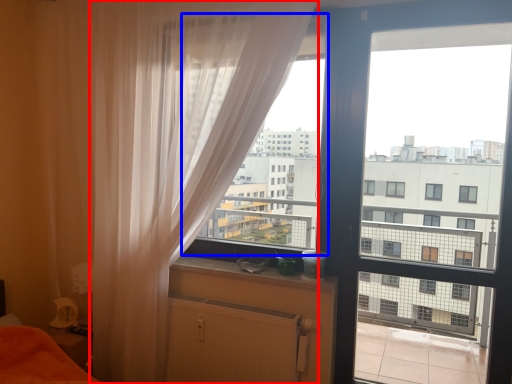
Question: Which point is closer to the camera, curtain (highlighted by a red box) or window screen (highlighted by a blue box)?

Choices:
 (A) curtain
 (B) window screen

Answer: (A)